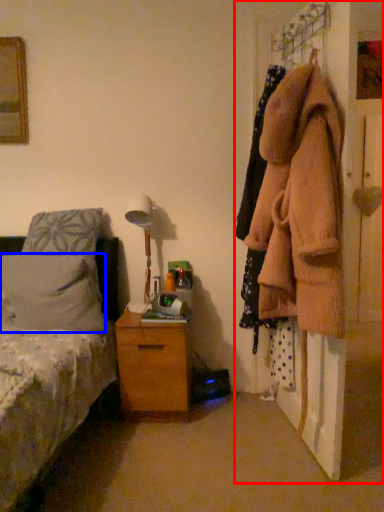
Question: Which object is closer to the camera taking this photo, closet (highlighted by a red box) or pillow (highlighted by a blue box)?

Choices:
 (A) closet
 (B) pillow

Answer: (A)